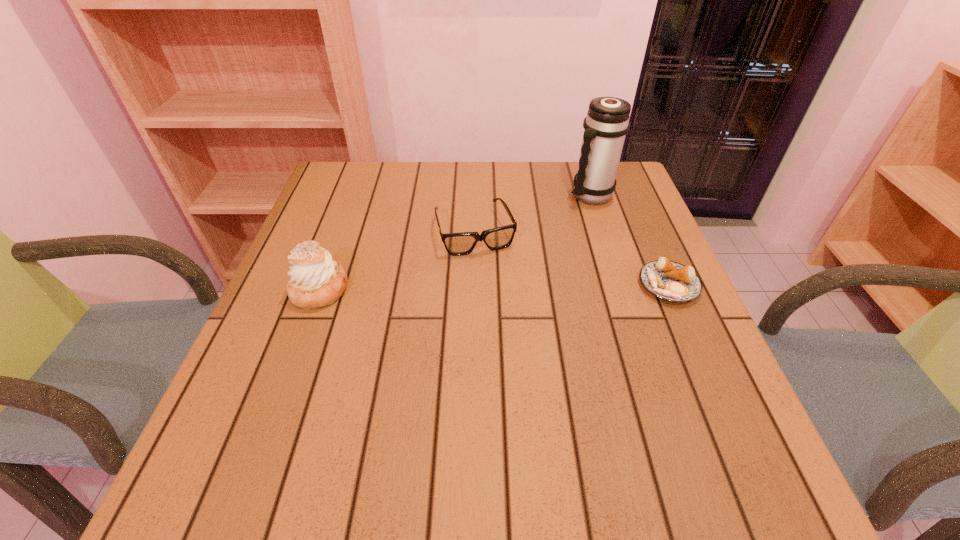
This screenshot has width=960, height=540. Find the location of `object that is at the far right corner`. object that is at the far right corner is located at coordinates (607, 122).

Find the location of `blank space at the far edge of the desktop`. blank space at the far edge of the desktop is located at coordinates (424, 179).

The height and width of the screenshot is (540, 960). In order to click on vacant space at the near edge in this screenshot , I will do `click(506, 396)`.

You are a GUI agent. You are given a task and a screenshot of the screen. Output one action in this format:
    pyautogui.click(x=<x>, y=<y>)
    Task: Click on the vacant space at the left edge
    The width and height of the screenshot is (960, 540).
    Given the screenshot: What is the action you would take?
    pyautogui.click(x=257, y=333)

The image size is (960, 540). Find the location of `free space at the right edge of the desktop`. free space at the right edge of the desktop is located at coordinates (642, 210).

In the image, there is a desktop. Where is `vacant space at the far left corner`? The image size is (960, 540). vacant space at the far left corner is located at coordinates (350, 163).

At what (x,y) coordinates should I click in order to perform the action: click on blank space at the far right corner of the desktop. Please return your answer as a coordinate pair (x, y). This screenshot has height=540, width=960. Looking at the image, I should click on (623, 173).

Find the location of a particular element. The image size is (960, 540). vacant region between the second shortest object and the taller pastry is located at coordinates (397, 260).

You are a GUI agent. You are given a task and a screenshot of the screen. Output one action in this format:
    pyautogui.click(x=<x>, y=<y>)
    Task: Click on the free spot between the tallest object and the third object from right to left
    
    Given the screenshot: What is the action you would take?
    pyautogui.click(x=533, y=213)

What are the coordinates of `free space between the tallest object and the shorter pastry` in the screenshot? It's located at (630, 240).